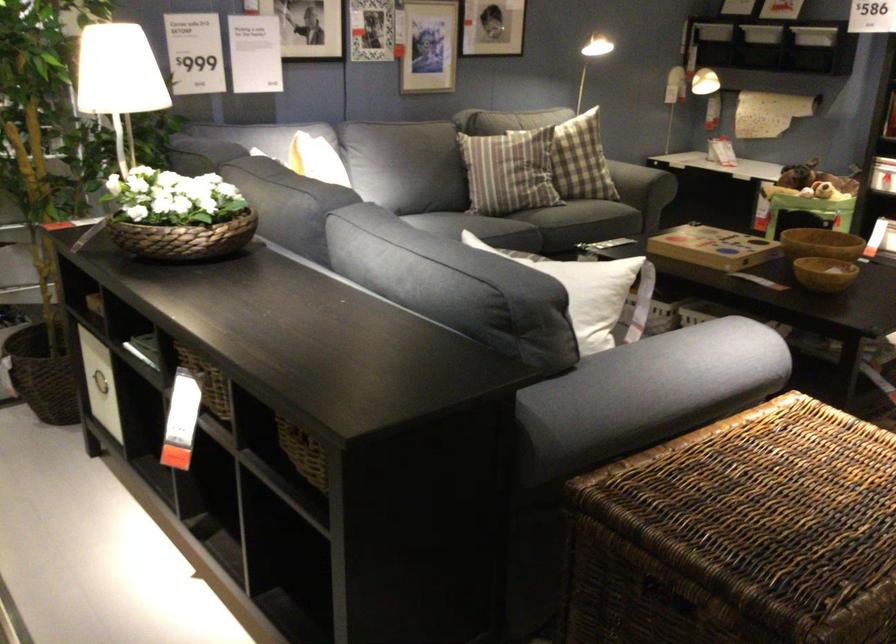
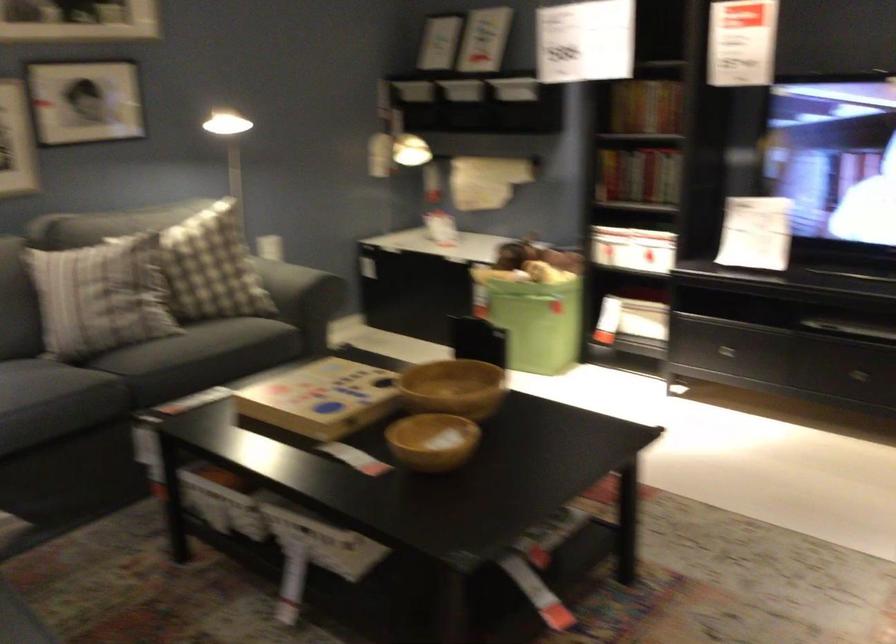
Locate, in the second image, the point that corresponds to the point at 614,223 in the first image.

(199, 357)